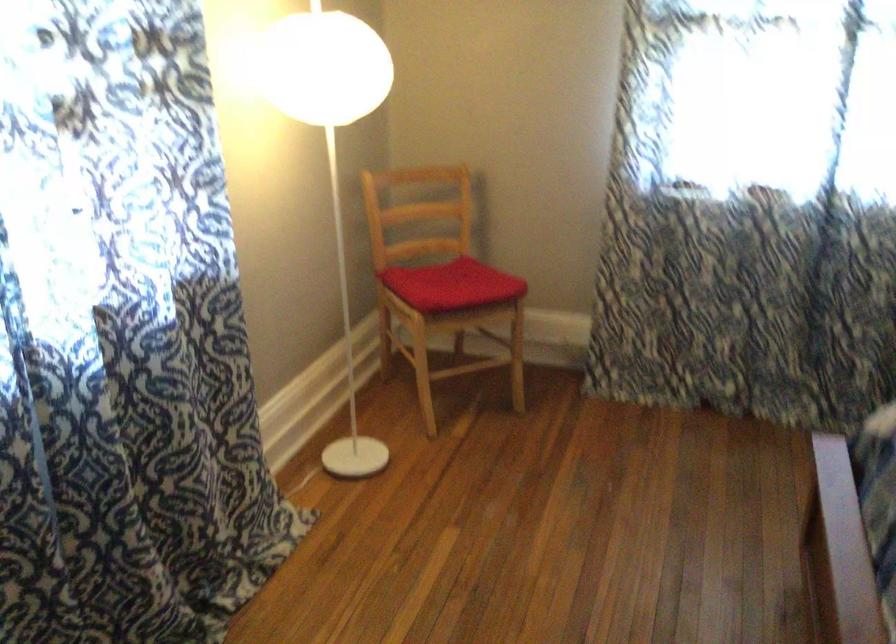
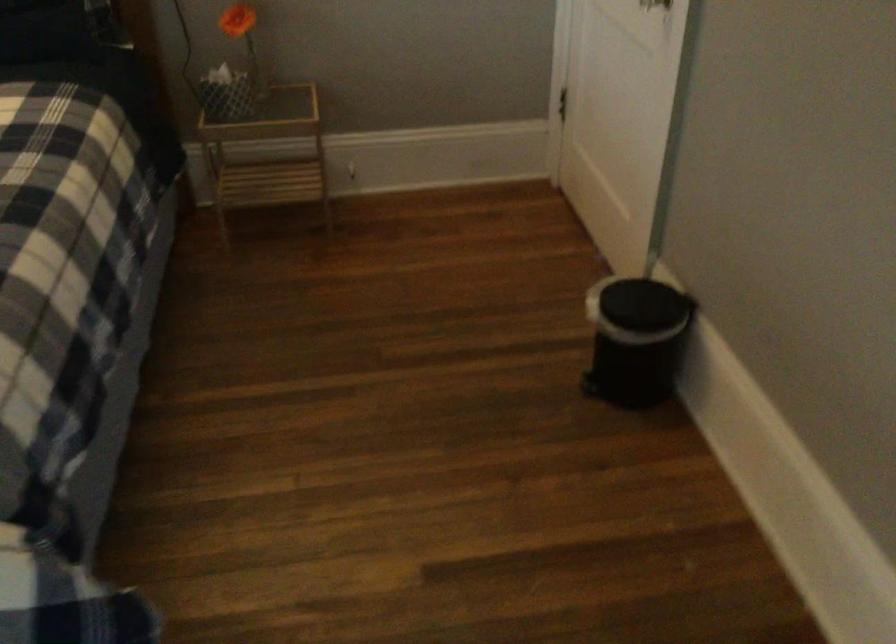
The images are taken continuously from a first-person perspective. In which direction is your viewpoint rotating?

The rotation direction of the camera is right-down.